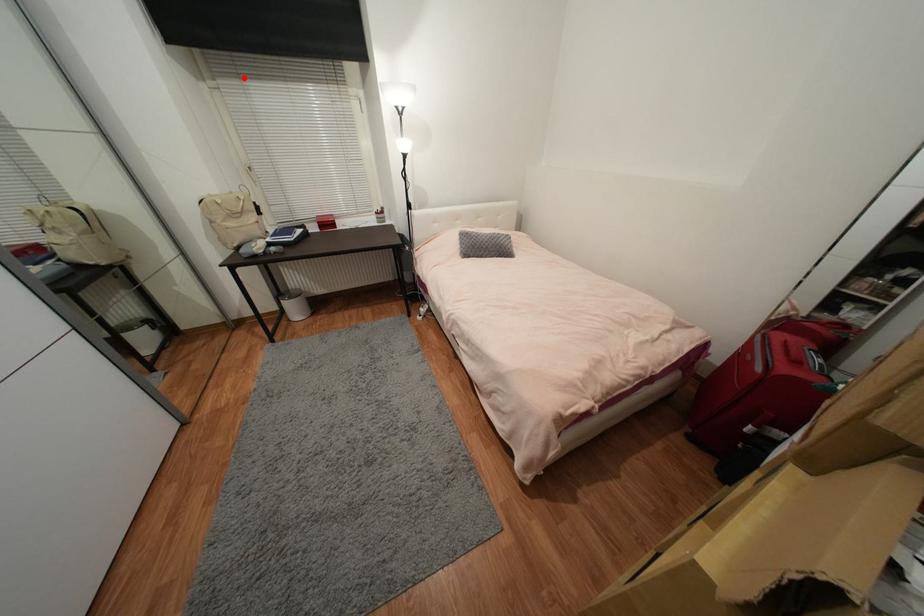
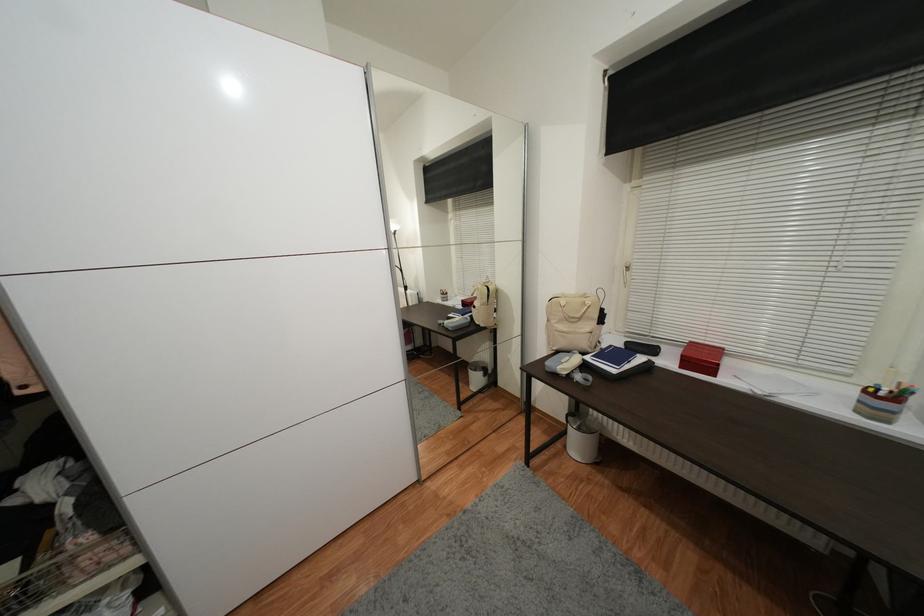
Where in the second image is the point corresponding to the highlighted location from the first image?

(678, 167)